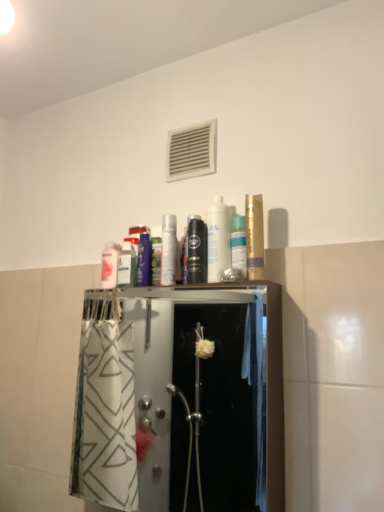
Question: From the image's perspective, is white plastic vent at upper center positioned above or below silver metallic can at center, placed as the second toiletry when sorted from left to right?

Choices:
 (A) below
 (B) above

Answer: (B)

Question: In terms of size, does white plastic vent at upper center appear bigger or smaller than silver metallic can at center, placed as the second toiletry when sorted from left to right?

Choices:
 (A) big
 (B) small

Answer: (A)

Question: Which object is positioned closest to the translucent plastic spray can at upper center, the first toiletry viewed from the right?

Choices:
 (A) black glossy mouthwash at center, which ranks as the second mouthwash in right-to-left order
 (B) gold metallic can at upper right, which ranks as the first mouthwash in right-to-left order
 (C) matte white canister at center, arranged as the 3th toiletry when viewed from the left
 (D) transparent plastic shower door at center
 (E) pink matte lotion at upper left, which is the first toiletry from left to right

Answer: (C)

Question: Estimate the real-world distances between objects in this image. Which object is closer to the matte white canister at center, the second toiletry viewed from the right?

Choices:
 (A) gold metallic can at upper right, which ranks as the 3th mouthwash in left-to-right order
 (B) black glossy mouthwash at center, which ranks as the second mouthwash in right-to-left order
 (C) pink matte lotion at upper left, which is the first toiletry from left to right
 (D) transparent plastic shower door at center
 (E) silver metallic can at center, which is the third toiletry from right to left

Answer: (B)